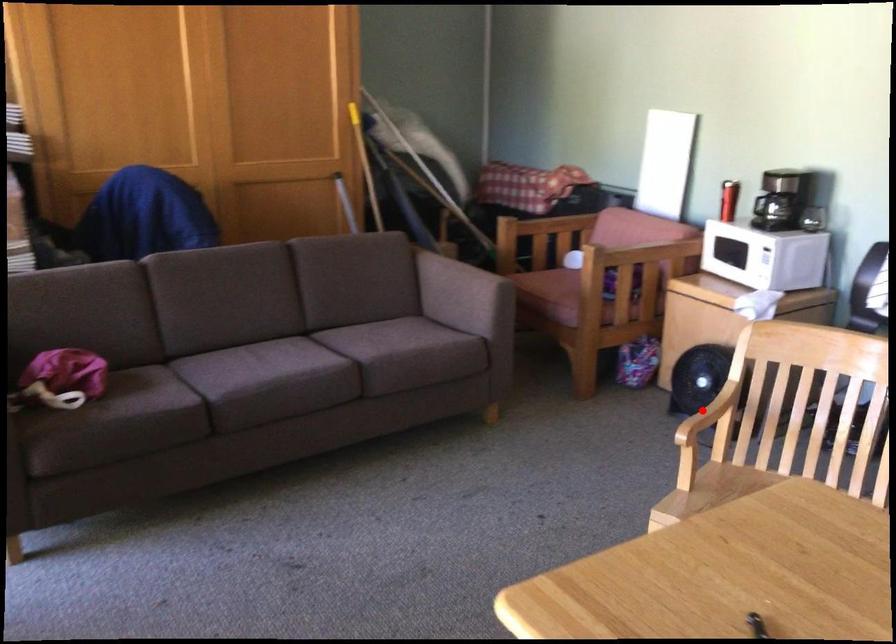
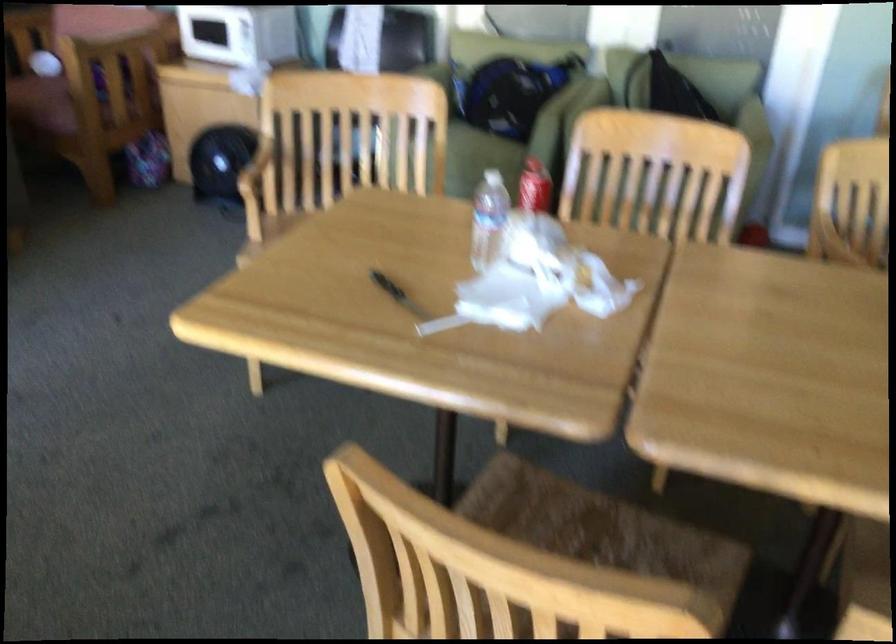
Question: A red point is marked in image1. In image2, is the corresponding 3D point closer to the camera or farther? Reply with the corresponding letter.

Choices:
 (A) The corresponding 3D point is closer.
 (B) The corresponding 3D point is farther.

Answer: (B)